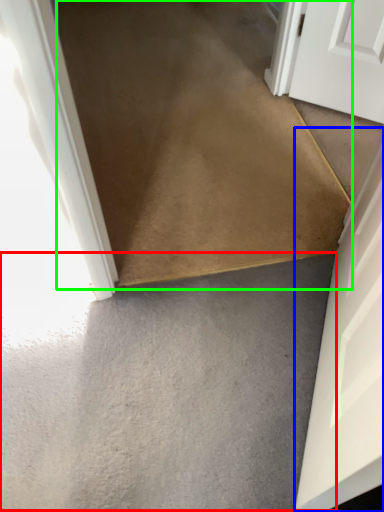
Question: Which is farther away from concrete (highlighted by a red box)? door (highlighted by a blue box) or path (highlighted by a green box)?

Choices:
 (A) door
 (B) path

Answer: (B)